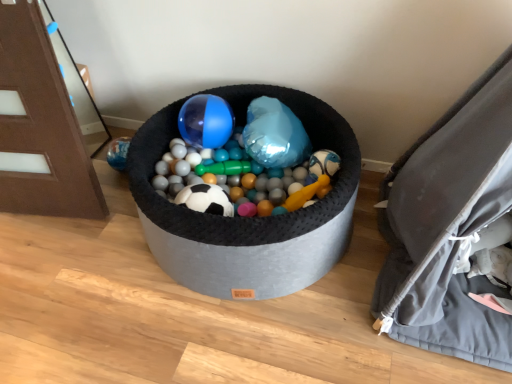
Question: Does gray fabric bean bag chair at right lie behind brushed wood door at left?

Choices:
 (A) no
 (B) yes

Answer: (A)

Question: Can brushed wood door at left be found inside gray fabric bean bag chair at right?

Choices:
 (A) no
 (B) yes

Answer: (A)

Question: Are gray fabric bean bag chair at right and brushed wood door at left far apart?

Choices:
 (A) yes
 (B) no

Answer: (A)

Question: From a real-world perspective, is gray fabric bean bag chair at right physically below brushed wood door at left?

Choices:
 (A) no
 (B) yes

Answer: (B)

Question: Is gray fabric bean bag chair at right facing towards brushed wood door at left?

Choices:
 (A) yes
 (B) no

Answer: (B)

Question: Considering the relative sizes of gray fabric bean bag chair at right and brushed wood door at left in the image provided, is gray fabric bean bag chair at right taller than brushed wood door at left?

Choices:
 (A) no
 (B) yes

Answer: (B)

Question: Is translucent plastic ball at center turned away from brushed wood door at left?

Choices:
 (A) yes
 (B) no

Answer: (B)

Question: Considering the relative sizes of translucent plastic ball at center and brushed wood door at left in the image provided, is translucent plastic ball at center taller than brushed wood door at left?

Choices:
 (A) no
 (B) yes

Answer: (A)

Question: Does translucent plastic ball at center appear on the left side of brushed wood door at left?

Choices:
 (A) no
 (B) yes

Answer: (A)

Question: Considering the relative sizes of translucent plastic ball at center and brushed wood door at left in the image provided, is translucent plastic ball at center bigger than brushed wood door at left?

Choices:
 (A) no
 (B) yes

Answer: (B)

Question: Could you tell me if translucent plastic ball at center is turned towards brushed wood door at left?

Choices:
 (A) no
 (B) yes

Answer: (A)

Question: Considering the relative sizes of translucent plastic ball at center and brushed wood door at left in the image provided, is translucent plastic ball at center wider than brushed wood door at left?

Choices:
 (A) no
 (B) yes

Answer: (B)

Question: Does brushed wood door at left lie in front of translucent plastic ball at center?

Choices:
 (A) yes
 (B) no

Answer: (A)